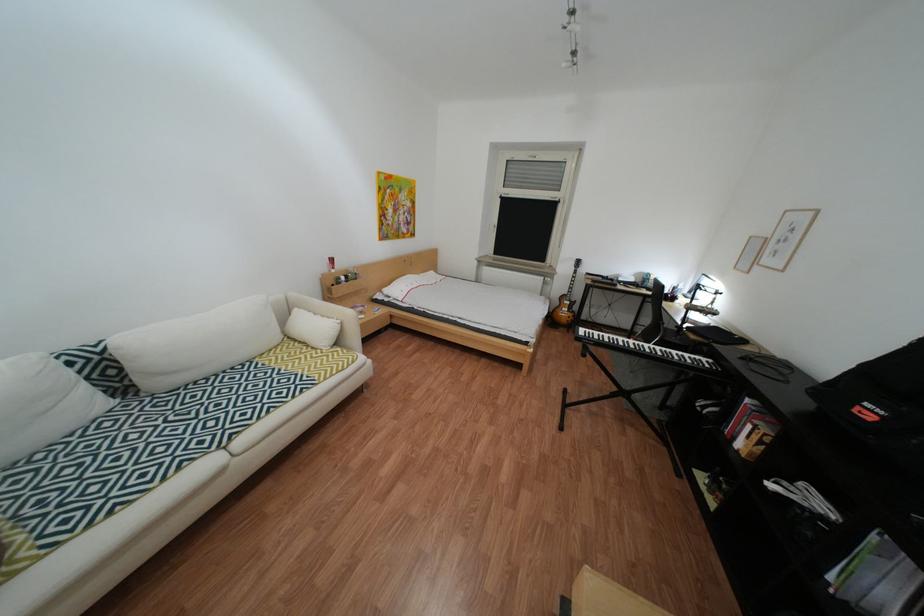
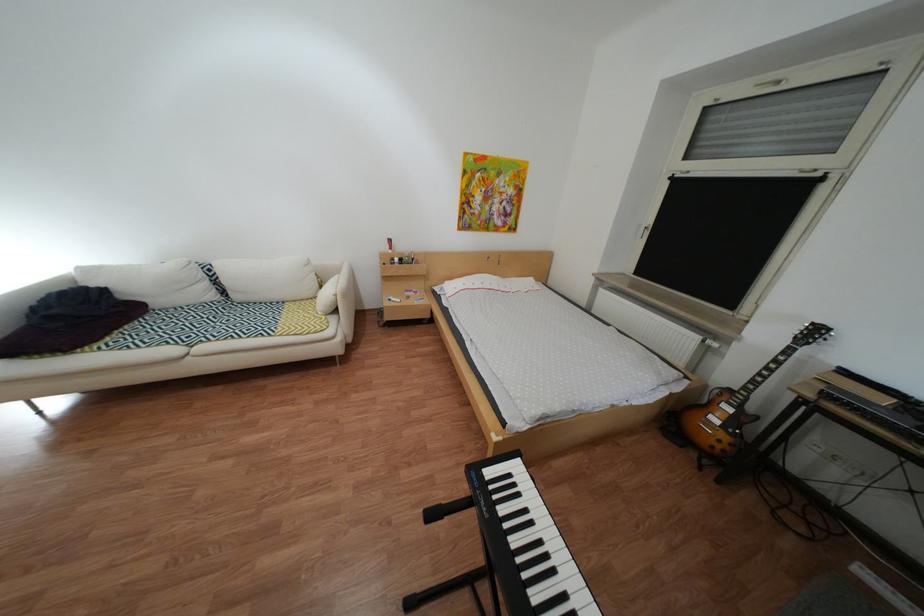
The point at (589, 264) is marked in the first image. Where is the corresponding point in the second image?

(810, 330)